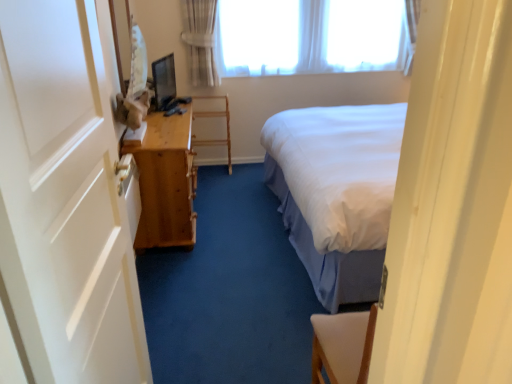
What is the approximate height of white painted wood door at left?

The height of white painted wood door at left is 5.15 feet.

Where is `wooden shelf at center`? This screenshot has width=512, height=384. wooden shelf at center is located at coordinates (215, 116).

From a real-world perspective, who is located higher, white sheer curtain at upper center or light brown wooden table at left?

white sheer curtain at upper center.

From the image's perspective, is white sheer curtain at upper center located above or below light brown wooden table at left?

Clearly, from the image's perspective, white sheer curtain at upper center is above light brown wooden table at left.

Is light brown wooden table at left located within white sheer curtain at upper center?

No, light brown wooden table at left is not a part of white sheer curtain at upper center.

How different are the orientations of white sheer curtain at upper center and light brown wooden table at left in degrees?

87.4 degrees.

From the picture: Which is less distant, (17,116) or (195,113)?

Point (17,116).

Considering the sizes of white painted wood door at left and wooden shelf at center in the image, is white painted wood door at left wider or thinner than wooden shelf at center?

Considering their sizes, white painted wood door at left looks slimmer than wooden shelf at center.

Between white painted wood door at left and wooden shelf at center, which one appears on the left side from the viewer's perspective?

wooden shelf at center is more to the left.

Is white painted wood door at left smaller than wooden shelf at center?

Incorrect, white painted wood door at left is not smaller in size than wooden shelf at center.

Looking at this image, considering the relative sizes of wooden shelf at center and light brown wooden table at left in the image provided, is wooden shelf at center smaller than light brown wooden table at left?

Yes, wooden shelf at center is smaller than light brown wooden table at left.

Is point (229, 125) less distant than point (183, 207)?

No, (229, 125) is behind (183, 207).

Does wooden shelf at center come in front of light brown wooden table at left?

No, wooden shelf at center is behind light brown wooden table at left.

Who is taller, wooden shelf at center or light brown wooden table at left?

light brown wooden table at left is taller.

From the image's perspective, which object appears higher, white painted wood door at left or light brown wooden table at left?

Result: From the image's view, light brown wooden table at left is above.

Which object is positioned more to the right, white painted wood door at left or light brown wooden table at left?

Positioned to the right is white painted wood door at left.

Who is taller, white painted wood door at left or light brown wooden table at left?

white painted wood door at left is taller.

Can you confirm if white painted wood door at left is wider than light brown wooden table at left?

No, white painted wood door at left is not wider than light brown wooden table at left.

Between white painted wood door at left and white sheer curtain at upper center, which one has smaller size?

white painted wood door at left is smaller.

Where is `door that is on the left side of white sheer curtain at upper center`? This screenshot has width=512, height=384. door that is on the left side of white sheer curtain at upper center is located at coordinates (66, 197).

Consider the image. Is white painted wood door at left inside the boundaries of white sheer curtain at upper center, or outside?

white painted wood door at left exists outside the volume of white sheer curtain at upper center.

Which of these two, light brown wooden table at left or wooden shelf at center, stands shorter?

wooden shelf at center is shorter.

What are the coordinates of `table below the wooden shelf at center (from a real-world perspective)` in the screenshot? It's located at (165, 182).

Which object is further away from the camera taking this photo, light brown wooden table at left or wooden shelf at center?

wooden shelf at center.

From a real-world perspective, is light brown wooden table at left on wooden shelf at center?

No, from a real-world perspective, light brown wooden table at left is not over wooden shelf at center

Considering the relative sizes of wooden shelf at center and white sheer curtain at upper center in the image provided, is wooden shelf at center thinner than white sheer curtain at upper center?

No.

Which point is more distant from viewer, (229, 123) or (376, 28)?

Point (229, 123)

Considering the relative sizes of wooden shelf at center and white sheer curtain at upper center in the image provided, is wooden shelf at center taller than white sheer curtain at upper center?

Indeed, wooden shelf at center has a greater height compared to white sheer curtain at upper center.

Which object is closer to the camera taking this photo, wooden shelf at center or white sheer curtain at upper center?

white sheer curtain at upper center is in front.

Image resolution: width=512 pixels, height=384 pixels. What are the coordinates of `table that appears below the white sheer curtain at upper center (from the image's perspective)` in the screenshot? It's located at coord(165,182).

There is a wooden shelf at center. Where is `door above it (from a real-world perspective)`? The width and height of the screenshot is (512, 384). door above it (from a real-world perspective) is located at coordinates (66, 197).

Estimate the real-world distances between objects in this image. Which object is further from white sheer curtain at upper center, light brown wooden table at left or white painted wood door at left?

The object further to white sheer curtain at upper center is white painted wood door at left.

Looking at the image, which one is located further to light brown wooden table at left, white sheer curtain at upper center or wooden shelf at center?

white sheer curtain at upper center.

When comparing their distances from wooden shelf at center, does light brown wooden table at left or white painted wood door at left seem further?

white painted wood door at left is further to wooden shelf at center.

Estimate the real-world distances between objects in this image. Which object is further from light brown wooden table at left, white painted wood door at left or white sheer curtain at upper center?

white sheer curtain at upper center is further to light brown wooden table at left.

Considering their positions, is white painted wood door at left positioned closer to wooden shelf at center than light brown wooden table at left?

Based on the image, light brown wooden table at left appears to be nearer to wooden shelf at center.

Considering their positions, is white sheer curtain at upper center positioned closer to wooden shelf at center than light brown wooden table at left?

white sheer curtain at upper center lies closer to wooden shelf at center than the other object.

Based on their spatial positions, is wooden shelf at center or light brown wooden table at left closer to white painted wood door at left?

light brown wooden table at left.

Which object lies further to the anchor point white sheer curtain at upper center, wooden shelf at center or white painted wood door at left?

white painted wood door at left is further to white sheer curtain at upper center.

Find the location of a particular element. window between white painted wood door at left and wooden shelf at center in the front-back direction is located at coordinates (313, 36).

Image resolution: width=512 pixels, height=384 pixels. In order to click on table positioned between white painted wood door at left and white sheer curtain at upper center from near to far in this screenshot , I will do `click(165, 182)`.

What are the coordinates of `window between light brown wooden table at left and wooden shelf at center from front to back` in the screenshot? It's located at (x=313, y=36).

The image size is (512, 384). Find the location of `table between white painted wood door at left and wooden shelf at center from front to back`. table between white painted wood door at left and wooden shelf at center from front to back is located at coordinates (165, 182).